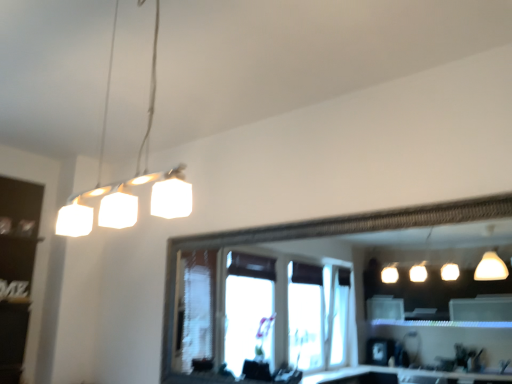
Question: Should I look upward or downward to see black matte shelf at left?

Choices:
 (A) up
 (B) down

Answer: (B)

Question: Does black matte shelf at left appear on the left side of white matte cube at upper left?

Choices:
 (A) yes
 (B) no

Answer: (A)

Question: From the image's perspective, does black matte shelf at left appear lower than white matte cube at upper left?

Choices:
 (A) no
 (B) yes

Answer: (B)

Question: Does black matte shelf at left turn towards white matte cube at upper left?

Choices:
 (A) no
 (B) yes

Answer: (A)

Question: From the image's perspective, is black matte shelf at left on white matte cube at upper left?

Choices:
 (A) yes
 (B) no

Answer: (B)

Question: Is black matte shelf at left beside white matte cube at upper left?

Choices:
 (A) yes
 (B) no

Answer: (B)

Question: From a real-world perspective, is black matte shelf at left under white matte cube at upper left?

Choices:
 (A) yes
 (B) no

Answer: (A)

Question: From the image's perspective, is white matte cube at upper left located above black matte shelf at left?

Choices:
 (A) no
 (B) yes

Answer: (B)

Question: Are white matte cube at upper left and black matte shelf at left located far from each other?

Choices:
 (A) yes
 (B) no

Answer: (B)

Question: Is white matte cube at upper left taller than black matte shelf at left?

Choices:
 (A) yes
 (B) no

Answer: (B)

Question: Can you confirm if white matte cube at upper left is thinner than black matte shelf at left?

Choices:
 (A) yes
 (B) no

Answer: (A)

Question: Can black matte shelf at left be found inside white matte cube at upper left?

Choices:
 (A) no
 (B) yes

Answer: (A)

Question: Is white matte cube at upper left to the left of black matte shelf at left from the viewer's perspective?

Choices:
 (A) no
 (B) yes

Answer: (A)

Question: Do you think black matte shelf at left is within white matte cube at upper left, or outside of it?

Choices:
 (A) inside
 (B) outside

Answer: (B)